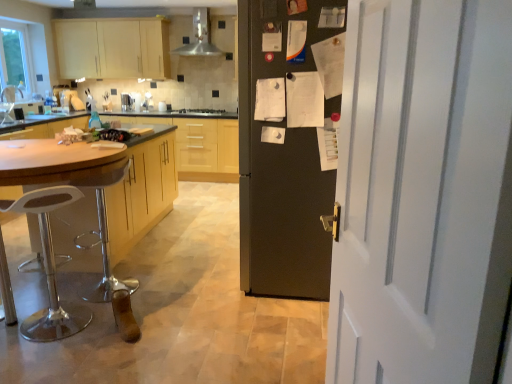
Question: From a real-world perspective, is white painted wood door at right positioned under metallic stainless steel range hood at upper center based on gravity?

Choices:
 (A) no
 (B) yes

Answer: (B)

Question: Is white painted wood door at right not close to metallic stainless steel range hood at upper center?

Choices:
 (A) no
 (B) yes

Answer: (B)

Question: From the image's perspective, is white painted wood door at right above metallic stainless steel range hood at upper center?

Choices:
 (A) no
 (B) yes

Answer: (A)

Question: Can you confirm if white painted wood door at right is taller than metallic stainless steel range hood at upper center?

Choices:
 (A) no
 (B) yes

Answer: (B)

Question: Is white painted wood door at right touching metallic stainless steel range hood at upper center?

Choices:
 (A) no
 (B) yes

Answer: (A)

Question: Can you confirm if white painted wood door at right is shorter than metallic stainless steel range hood at upper center?

Choices:
 (A) no
 (B) yes

Answer: (A)

Question: Would you say matte wood cabinets at upper left, which is the first cabinetry from top to bottom, is outside white painted wood door at right?

Choices:
 (A) no
 (B) yes

Answer: (B)

Question: Considering the relative sizes of matte wood cabinets at upper left, positioned as the 1th cabinetry in back-to-front order, and white painted wood door at right in the image provided, is matte wood cabinets at upper left, positioned as the 1th cabinetry in back-to-front order, shorter than white painted wood door at right?

Choices:
 (A) no
 (B) yes

Answer: (B)

Question: Is matte wood cabinets at upper left, which is the first cabinetry from top to bottom, in contact with white painted wood door at right?

Choices:
 (A) yes
 (B) no

Answer: (B)

Question: Considering the relative positions of matte wood cabinets at upper left, the second cabinetry in the front-to-back sequence, and white painted wood door at right in the image provided, is matte wood cabinets at upper left, the second cabinetry in the front-to-back sequence, behind white painted wood door at right?

Choices:
 (A) yes
 (B) no

Answer: (A)

Question: Could you tell me if matte wood cabinets at upper left, which is the first cabinetry from top to bottom, is turned towards white painted wood door at right?

Choices:
 (A) no
 (B) yes

Answer: (B)

Question: Is matte wood cabinets at upper left, the second cabinetry in the front-to-back sequence, not close to white painted wood door at right?

Choices:
 (A) no
 (B) yes

Answer: (B)

Question: Considering the relative sizes of wooden cabinet at center, which is counted as the first cabinetry, starting from the bottom, and black matte stove at center in the image provided, is wooden cabinet at center, which is counted as the first cabinetry, starting from the bottom, smaller than black matte stove at center?

Choices:
 (A) no
 (B) yes

Answer: (A)